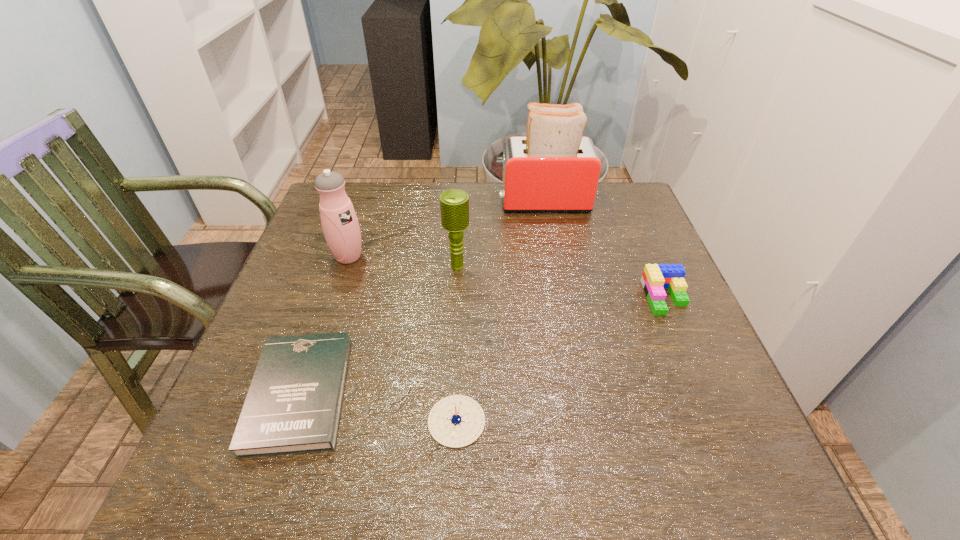
Where is `vacant space that's between the microphone and the thermos bottle`? This screenshot has width=960, height=540. vacant space that's between the microphone and the thermos bottle is located at coordinates (403, 261).

Identify the location of object that is the second closest to the thermos bottle. Image resolution: width=960 pixels, height=540 pixels. (293, 406).

Identify the location of the third closest object to the third nearest object. (456, 421).

You are a GUI agent. You are given a task and a screenshot of the screen. Output one action in this format:
    pyautogui.click(x=<x>, y=<y>)
    Task: Click on the free location that satisfies the following two spatial constraints: 1. on the front side of the third tallest object; 2. on the right side of the compass
    This screenshot has height=540, width=960.
    Given the screenshot: What is the action you would take?
    pyautogui.click(x=448, y=421)